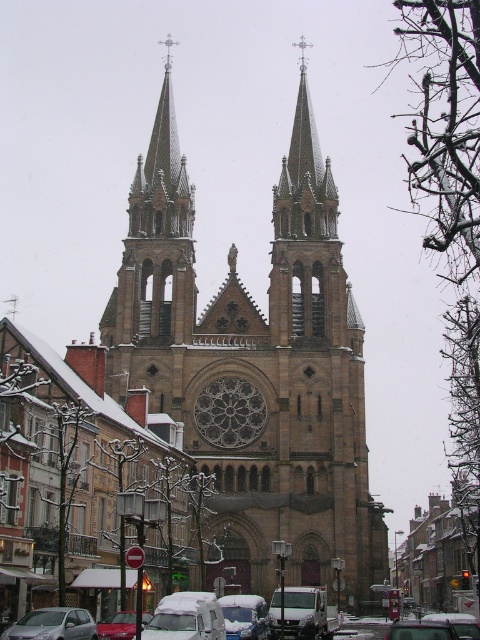
Question: Is brown stone church at center positioned behind silver metallic van at center?

Choices:
 (A) no
 (B) yes

Answer: (B)

Question: Which point is farther from the camera taking this photo?

Choices:
 (A) (36, 624)
 (B) (352, 600)
 (C) (447, 637)

Answer: (B)

Question: Is white matte car at center smaller than snow-covered sedan at center?

Choices:
 (A) no
 (B) yes

Answer: (A)

Question: Among these objects, which one is nearest to the camera?

Choices:
 (A) white matte car at center
 (B) snow-covered sedan at center

Answer: (A)

Question: Which of the following is the closest to the observer?

Choices:
 (A) brown stone church at center
 (B) silver metallic hatchback at center
 (C) silver metallic van at center
 (D) white matte car at center

Answer: (D)

Question: Does silver metallic van at center have a larger size compared to metallic silver car at center?

Choices:
 (A) no
 (B) yes

Answer: (A)